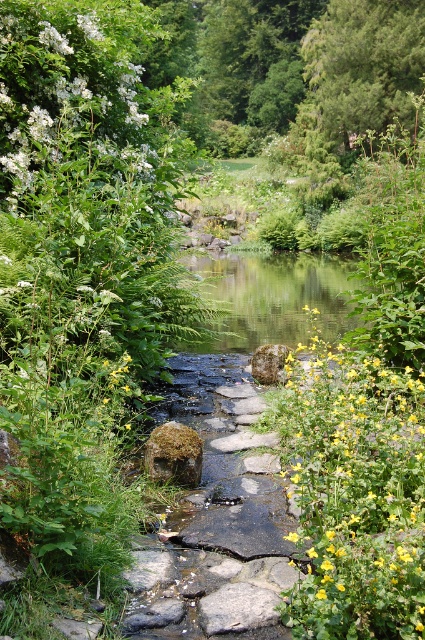
Between yellow matte flower at center-right and white fluffy flowers at upper left, which one is positioned lower?

Positioned lower is yellow matte flower at center-right.

Who is higher up, yellow matte flower at center-right or white fluffy flowers at upper left?

white fluffy flowers at upper left is higher up.

You are a GUI agent. You are given a task and a screenshot of the screen. Output one action in this format:
    pyautogui.click(x=<x>, y=<y>)
    Task: Click on the yellow matte flower at center-right
    
    Given the screenshot: What is the action you would take?
    pyautogui.click(x=354, y=493)